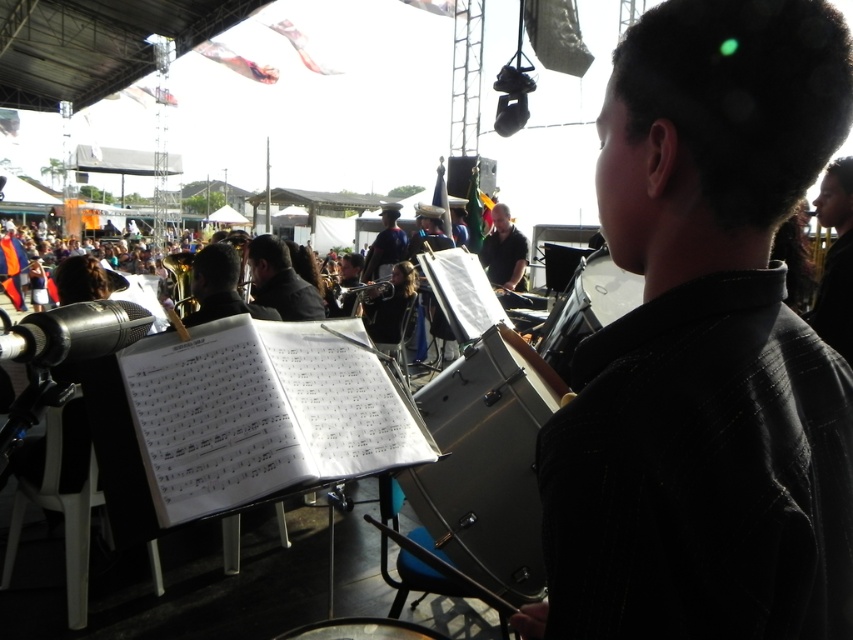
Question: Is black textured shirt at center smaller than shiny silver drum at center?

Choices:
 (A) no
 (B) yes

Answer: (B)

Question: Which object appears closest to the camera in this image?

Choices:
 (A) black matte shirt at center
 (B) black textured shirt at center

Answer: (B)

Question: Is metallic drum at center to the right of gold brass tuba at center from the viewer's perspective?

Choices:
 (A) yes
 (B) no

Answer: (A)

Question: Which object is the farthest from the gold brass tuba at center?

Choices:
 (A) dark gray uniform at center
 (B) shiny silver drum at center
 (C) metallic drum at center
 (D) black matte shirt at center

Answer: (D)

Question: Among these points, which one is farthest from the camera?

Choices:
 (A) (460, 536)
 (B) (517, 257)
 (C) (263, 253)

Answer: (B)

Question: Where is metallic drum at center located in relation to black matte shirt at center in the image?

Choices:
 (A) left
 (B) right

Answer: (A)